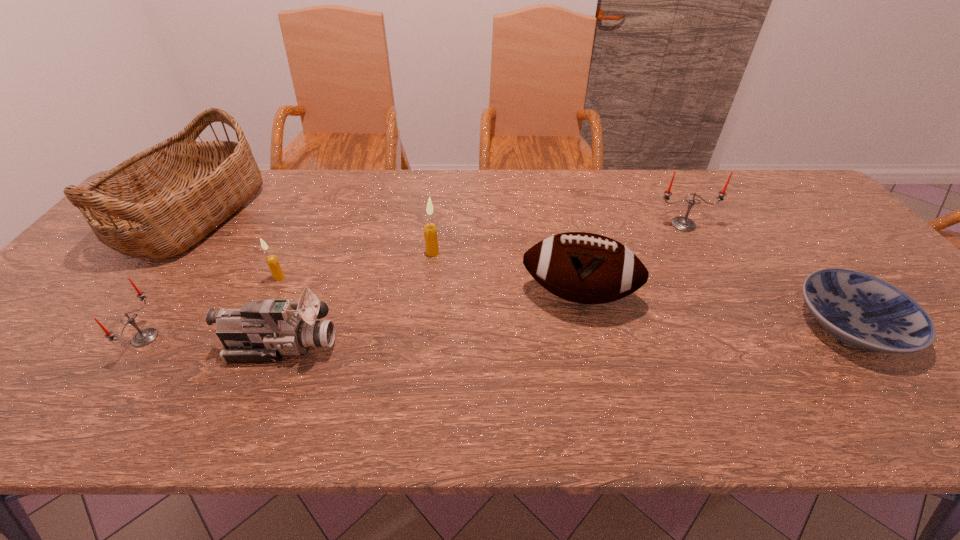
Locate an element on the screen. The width and height of the screenshot is (960, 540). basket is located at coordinates (157, 204).

I want to click on the tallest object, so click(157, 204).

Locate an element on the screen. This screenshot has height=540, width=960. the farthest candle is located at coordinates (685, 224).

Identify the location of the right red candle. The width and height of the screenshot is (960, 540). (685, 224).

Locate an element on the screen. This screenshot has width=960, height=540. the second candle from right to left is located at coordinates (430, 231).

Locate an element on the screen. The width and height of the screenshot is (960, 540). the second farthest candle is located at coordinates (430, 231).

Image resolution: width=960 pixels, height=540 pixels. Find the location of `the third object from right to left`. the third object from right to left is located at coordinates (586, 268).

You are a GUI agent. You are given a task and a screenshot of the screen. Output one action in this format:
    pyautogui.click(x=<x>, y=<y>)
    Task: Click on the camcorder
    This screenshot has width=960, height=540.
    Given the screenshot: What is the action you would take?
    pyautogui.click(x=263, y=331)

You are a GUI agent. You are given a task and a screenshot of the screen. Output one action in this format:
    pyautogui.click(x=<x>, y=<y>)
    Task: Click on the third farthest candle
    Image resolution: width=960 pixels, height=540 pixels.
    Given the screenshot: What is the action you would take?
    pyautogui.click(x=277, y=273)

Image resolution: width=960 pixels, height=540 pixels. In order to click on the left cream candle in this screenshot , I will do `click(277, 273)`.